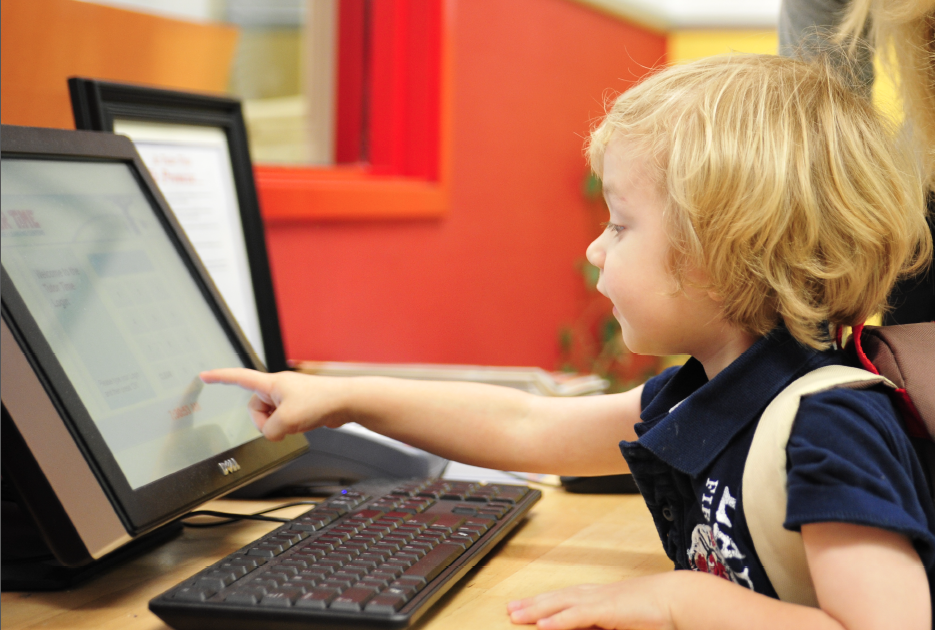
Where is `1 desk`? 1 desk is located at coordinates (553, 539).